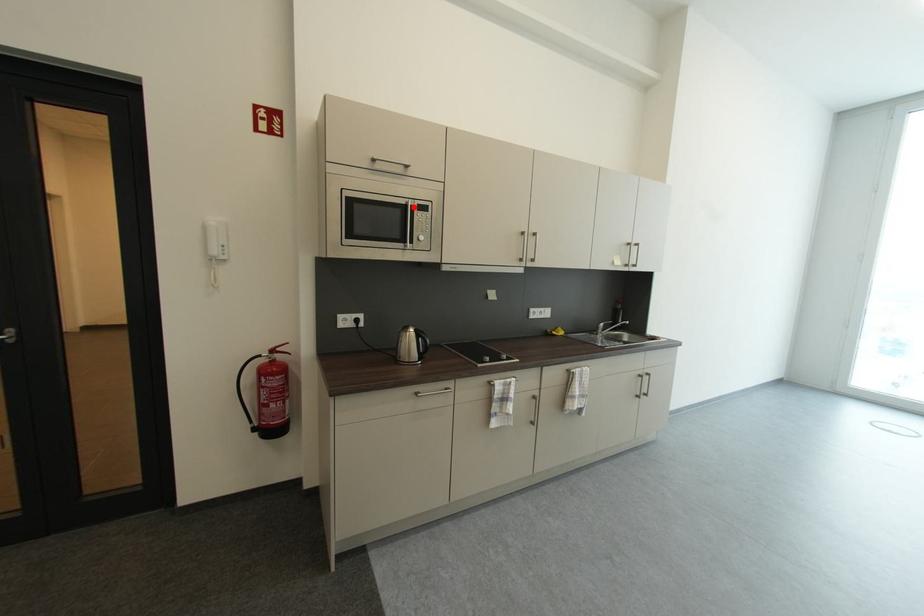
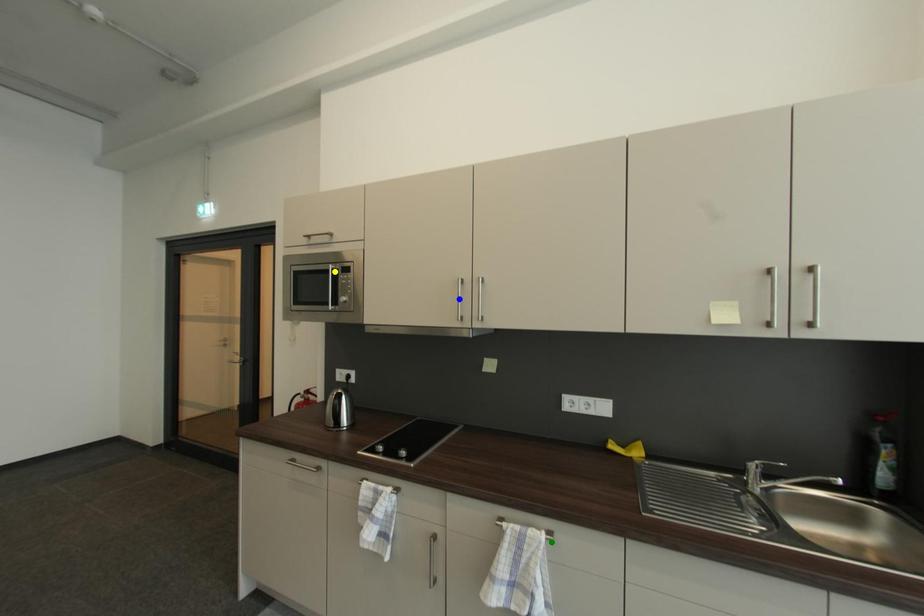
Question: I am providing you with two images of the same scene from different viewpoints. A red point is marked on the first image. You are given multiple points on the second image. Which point in image 2 represents the same 3d spot as the red point in image 1?

Choices:
 (A) blue point
 (B) green point
 (C) yellow point

Answer: (C)